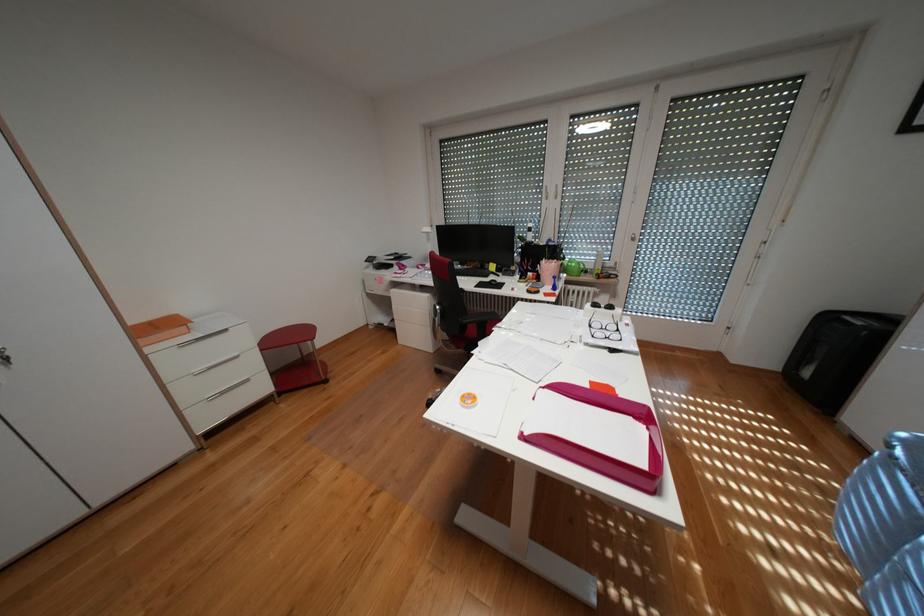
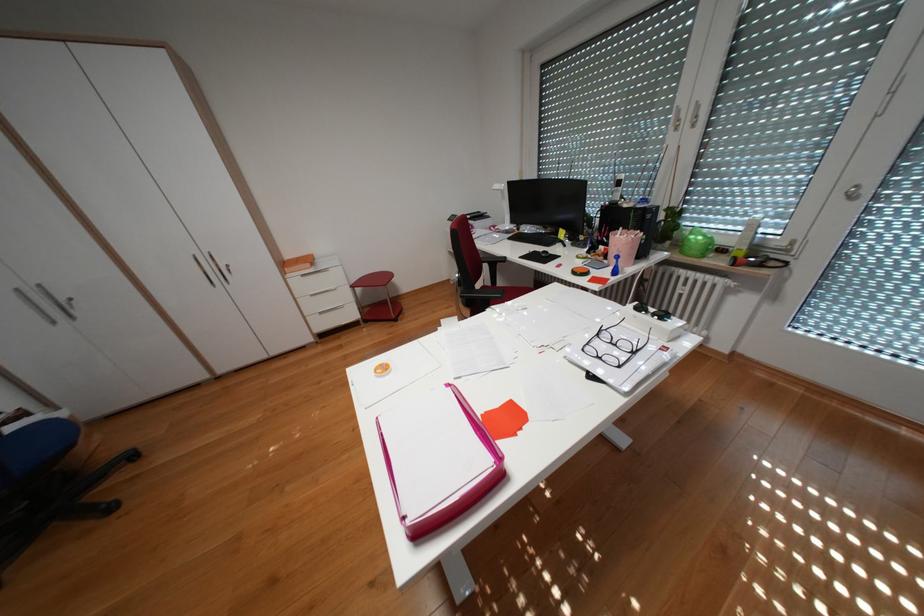
Find the pixel in the second image that matches (x=602, y=325) in the first image.

(610, 334)